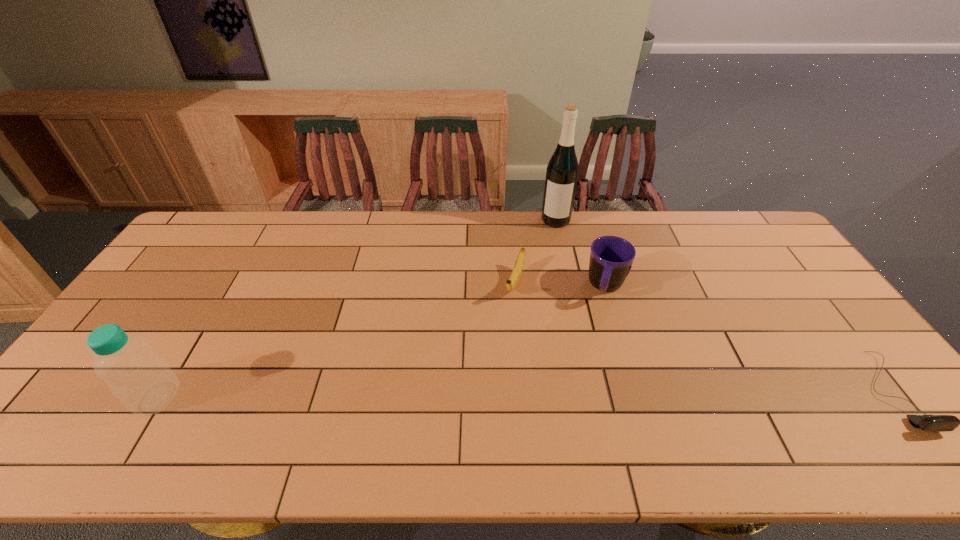
This screenshot has height=540, width=960. What are the coordinates of `free spot on the desktop that is between the bottle and the shortest object and is positioned at the stem of the fourth tallest object` in the screenshot? It's located at (470, 394).

Identify the location of vacant space on the desktop that is between the leftmost object and the shortest object and is positioned on the label of the wine bottle. This screenshot has width=960, height=540. (525, 394).

At what (x,y) coordinates should I click in order to perform the action: click on free spot on the desktop that is between the bottle and the rightmost object and is positioned with the handle on the side of the mug. Please return your answer as a coordinate pair (x, y). Image resolution: width=960 pixels, height=540 pixels. Looking at the image, I should click on (578, 394).